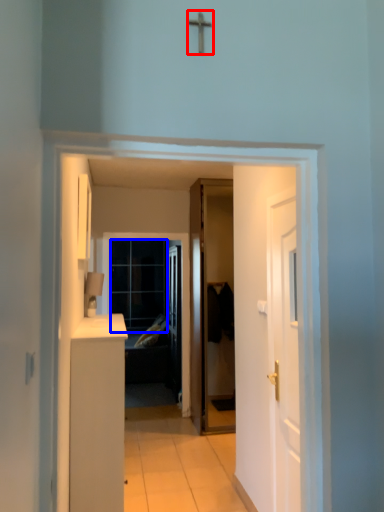
Question: Which object is further to the camera taking this photo, crucifix (highlighted by a red box) or glass door (highlighted by a blue box)?

Choices:
 (A) crucifix
 (B) glass door

Answer: (B)